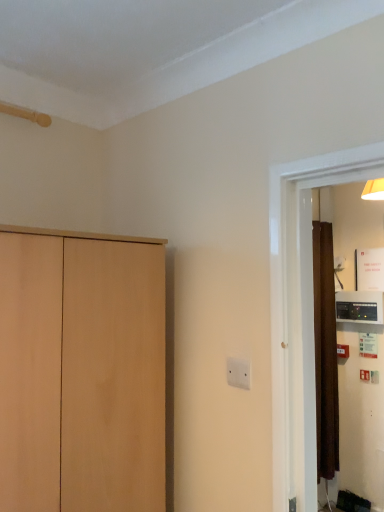
Question: In terms of width, does black plastic thermostat at right look wider or thinner when compared to light wood cupboard at left?

Choices:
 (A) thin
 (B) wide

Answer: (A)

Question: Is black plastic thermostat at right to the left or to the right of light wood cupboard at left in the image?

Choices:
 (A) right
 (B) left

Answer: (A)

Question: Which of these objects is positioned farthest from the light wood cupboard at left?

Choices:
 (A) black plastic thermostat at right
 (B) white plastic electric outlet at center

Answer: (A)

Question: Considering the real-world distances, which object is farthest from the light wood cupboard at left?

Choices:
 (A) black plastic thermostat at right
 (B) white plastic electric outlet at center

Answer: (A)